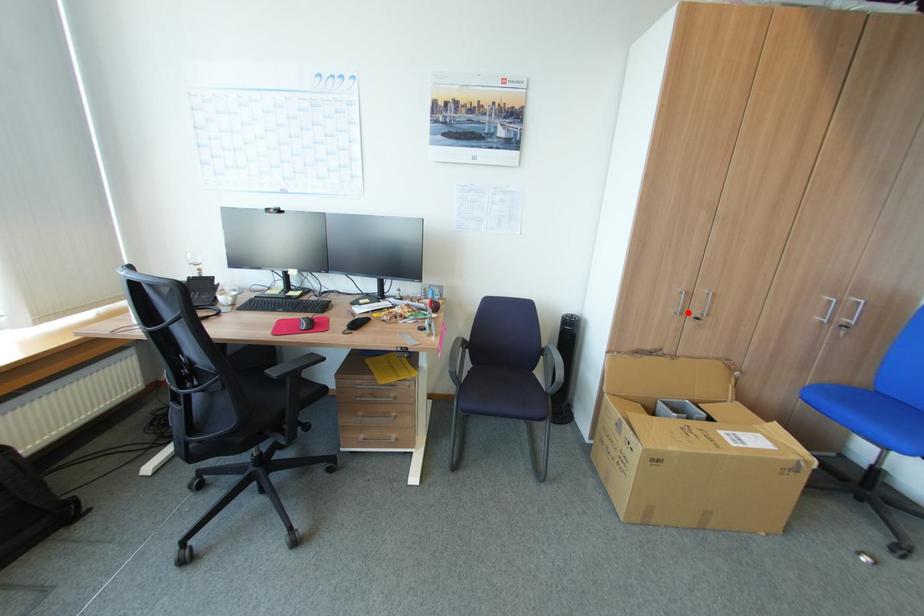
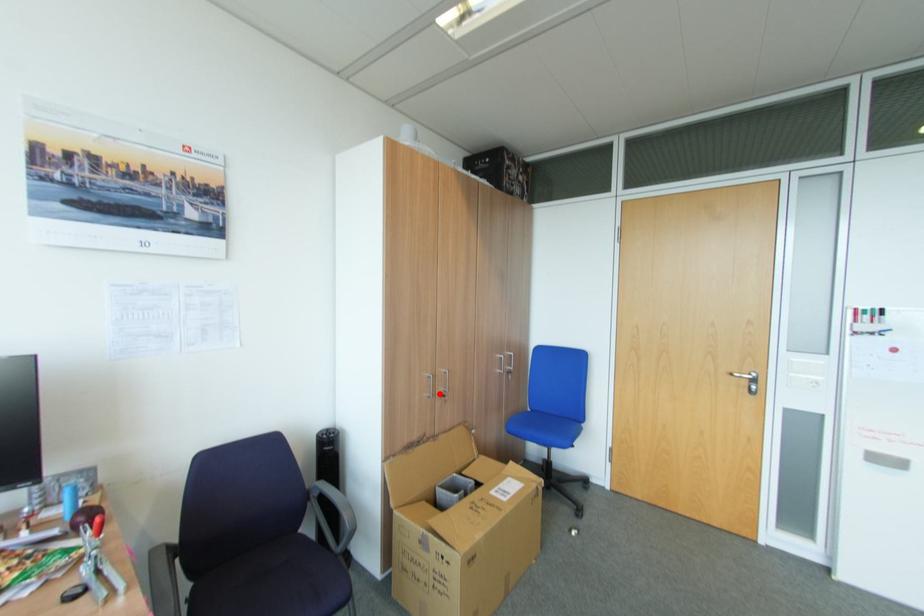
I am providing you with two images of the same scene from different viewpoints. A red point is marked on the first image and another point is marked on the second image. Are the points marked in image1 and image2 representing the same 3D position?

Yes